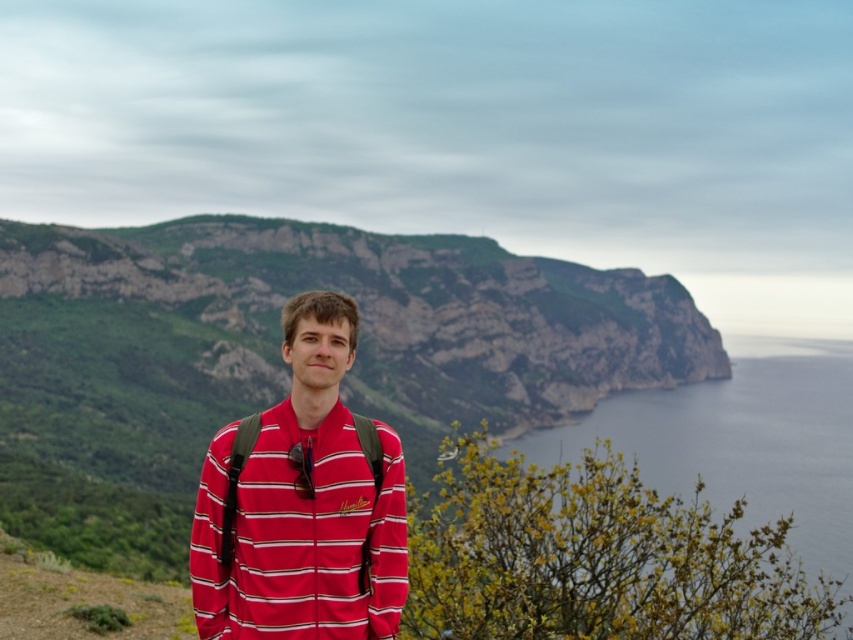
You are a photographer standing at the camera position. You want to place a green textured rock at center in the foreground of your photo. Given that the rock is currently 135.91 meters away from your camera, is it close enough to be in focus if your lens can sharply focus objects between 2 meters and infinity?

The green textured rock at center is 135.91 meters away from the camera. Since the lens can focus objects as far as infinity, the rock will be within the focus range and appear sharp in the photo.

You are a photographer trying to capture the person in the red striped shirt at center and the smooth blue water at lower right in a single frame. Given the size difference between them, which object should you focus on first to ensure both are clearly visible in your photo?

The red striped shirt at center is smaller than the smooth blue water at lower right. To ensure both are clearly visible, focus on the red striped shirt at center first since it is smaller and might require more attention to detail.

You are a photographer trying to capture the person in the red striped shirt at center while also including the smooth blue water at lower right in the frame. Based on their positions, will the person appear taller or shorter in the photo compared to the water?

The red striped shirt at center is shorter than the smooth blue water at lower right, so in the photo, the person will appear shorter compared to the water.